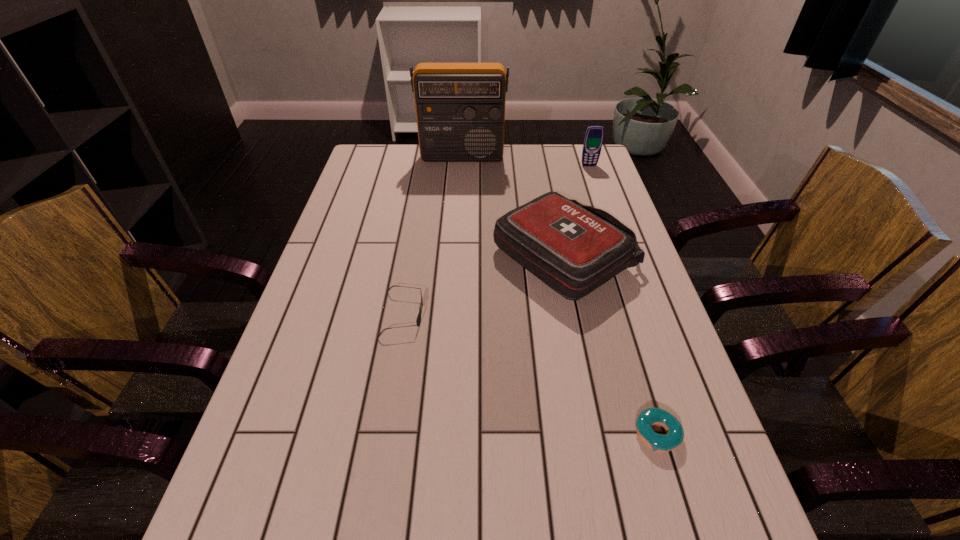
You are a GUI agent. You are given a task and a screenshot of the screen. Output one action in this format:
    pyautogui.click(x=<x>, y=<y>)
    Task: Click on the free space located 0.050m on the front of the doughnut
    This screenshot has height=540, width=960.
    Given the screenshot: What is the action you would take?
    pyautogui.click(x=672, y=484)

Locate an element on the screen. The image size is (960, 540). radio receiver present at the far edge is located at coordinates (460, 107).

Where is `cellular telephone that is at the far edge`? cellular telephone that is at the far edge is located at coordinates (594, 135).

Locate an element on the screen. cellular telephone that is positioned at the right edge is located at coordinates (594, 135).

You are a GUI agent. You are given a task and a screenshot of the screen. Output one action in this format:
    pyautogui.click(x=<x>, y=<y>)
    Task: Click on the first-aid kit at the right edge
    The width and height of the screenshot is (960, 540).
    Given the screenshot: What is the action you would take?
    pyautogui.click(x=574, y=249)

Locate an element on the screen. This screenshot has height=540, width=960. doughnut that is at the right edge is located at coordinates [x=651, y=416].

Where is `object that is at the far right corner`? The height and width of the screenshot is (540, 960). object that is at the far right corner is located at coordinates (594, 135).

This screenshot has width=960, height=540. In the image, there is a desktop. What are the coordinates of `vacant space at the far edge` in the screenshot? It's located at (551, 147).

At what (x,y) coordinates should I click in order to perform the action: click on free point at the left edge. Please return your answer as a coordinate pair (x, y). The width and height of the screenshot is (960, 540). Looking at the image, I should click on (291, 364).

The image size is (960, 540). What are the coordinates of `free space at the right edge` in the screenshot? It's located at (607, 356).